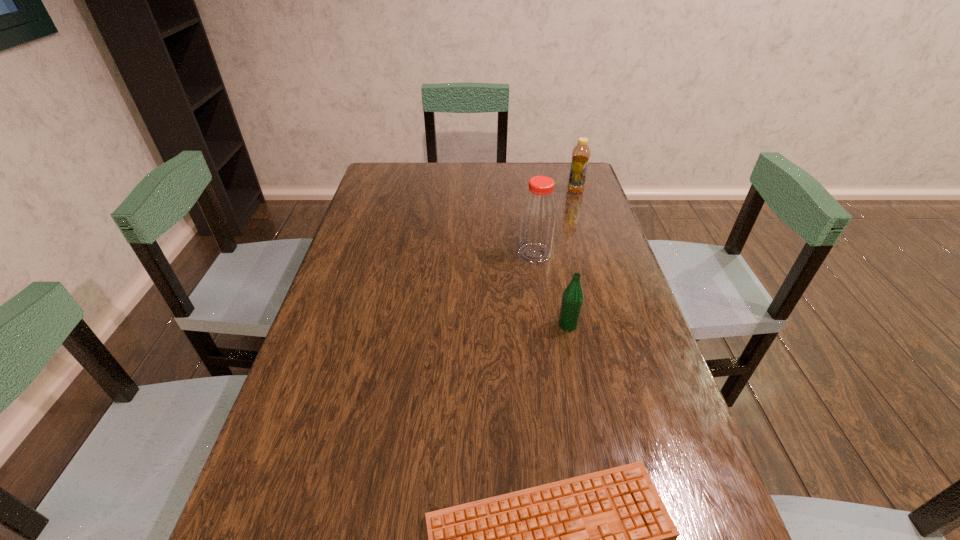
What are the coordinates of `the tallest bottle` in the screenshot? It's located at (538, 214).

This screenshot has height=540, width=960. I want to click on the second farthest bottle, so click(x=538, y=214).

I want to click on the farthest object, so click(x=581, y=153).

You are a GUI agent. You are given a task and a screenshot of the screen. Output one action in this format:
    pyautogui.click(x=<x>, y=<y>)
    Task: Click on the rightmost bottle
    Image resolution: width=960 pixels, height=540 pixels.
    Given the screenshot: What is the action you would take?
    (x=581, y=153)

Where is `the nearest bottle`? The width and height of the screenshot is (960, 540). the nearest bottle is located at coordinates (572, 298).

Where is `the shortest bottle`? The image size is (960, 540). the shortest bottle is located at coordinates (572, 298).

Locate an element on the screen. Image resolution: width=960 pixels, height=540 pixels. blank area located 0.270m on the back of the tallest bottle is located at coordinates (526, 198).

This screenshot has width=960, height=540. Identify the location of vacant position located on the front of the farthest object. (581, 208).

The height and width of the screenshot is (540, 960). In order to click on free space located 0.360m on the back of the nearest bottle in this screenshot , I will do `click(549, 234)`.

This screenshot has height=540, width=960. I want to click on object that is at the far edge, so click(x=581, y=153).